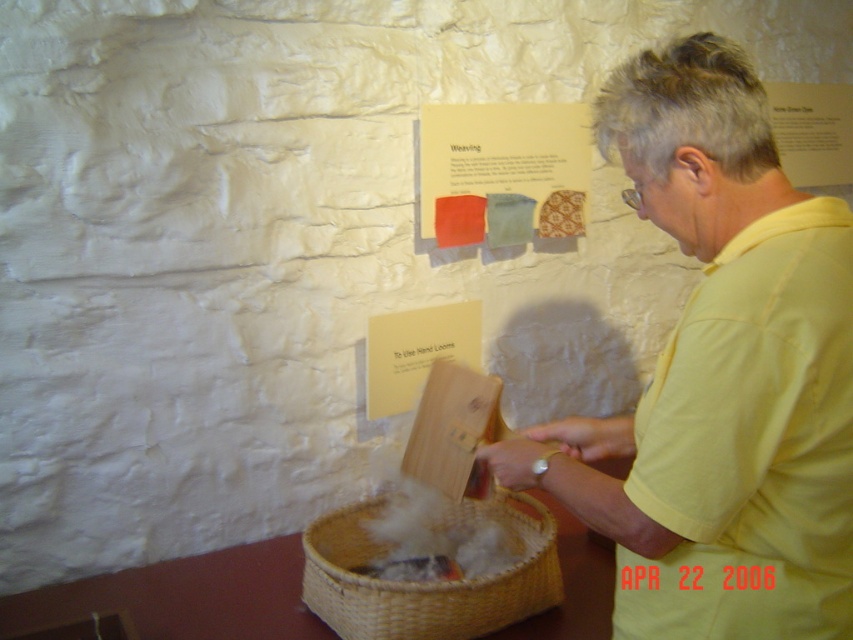
Is point (465, 186) closer to camera compared to point (780, 109)?

That is True.

Between matte paper poster at upper center and matte brown paper at upper right, which one appears on the left side from the viewer's perspective?

matte paper poster at upper center

Between point (556, 134) and point (844, 90), which one is positioned behind?

Positioned behind is point (844, 90).

Where is `matte paper poster at upper center`? This screenshot has height=640, width=853. matte paper poster at upper center is located at coordinates (502, 172).

Is matte paper poster at upper center positioned behind woven straw basket at lower center?

Yes, matte paper poster at upper center is behind woven straw basket at lower center.

Between matte paper poster at upper center and woven straw basket at lower center, which one appears on the left side from the viewer's perspective?

Positioned to the left is woven straw basket at lower center.

Locate an element on the screen. matte paper poster at upper center is located at coordinates (502, 172).

Find the location of a particular element. matte paper poster at upper center is located at coordinates (502, 172).

From the picture: Which is more to the right, yellow cotton shirt at center or matte brown paper at upper right?

matte brown paper at upper right

Which of these two, yellow cotton shirt at center or matte brown paper at upper right, stands shorter?

matte brown paper at upper right

Does point (848, 586) come closer to viewer compared to point (793, 160)?

That is True.

Locate an element on the screen. yellow cotton shirt at center is located at coordinates (720, 376).